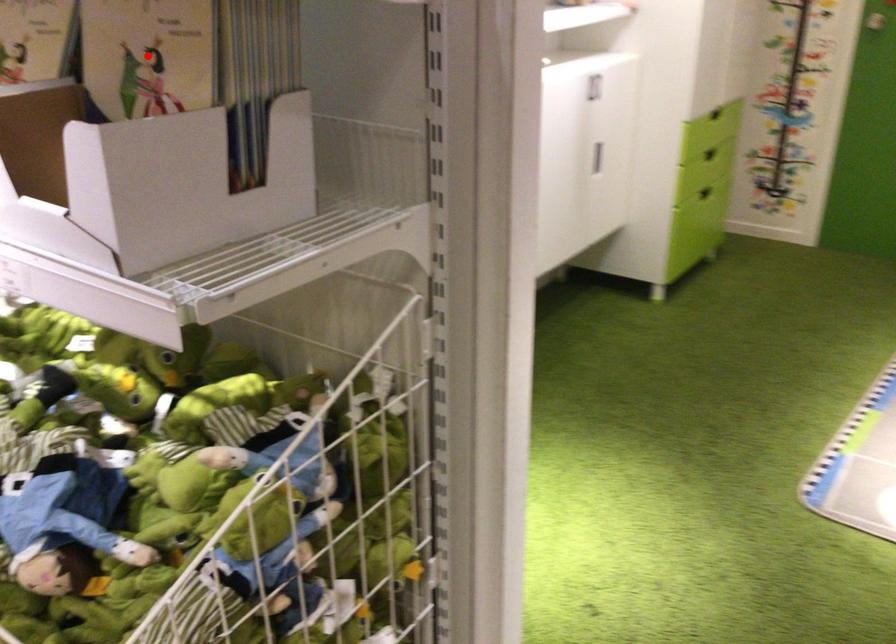
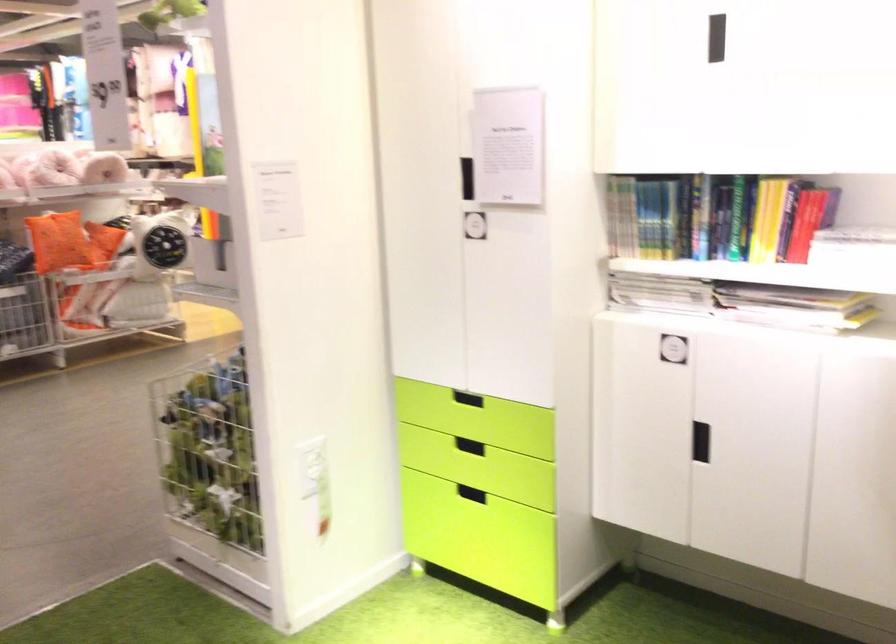
Question: I am providing you with two images of the same scene from different viewpoints. A red point is marked on the first image. Is the red point's position out of view in image 2?

Choices:
 (A) Yes
 (B) No

Answer: (A)